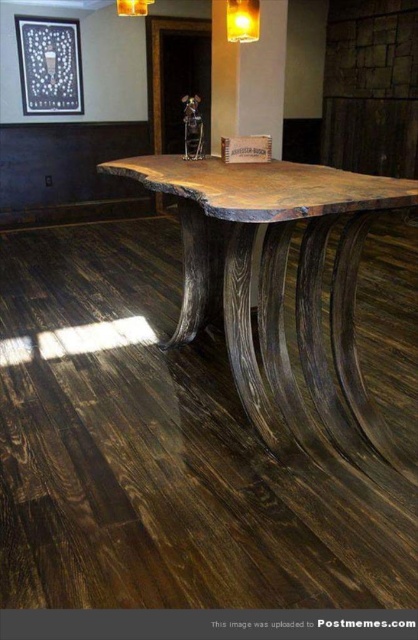
Between point (102, 168) and point (132, 1), which one is positioned behind?

The point (102, 168) is behind.

In order to click on dark wood table at center in this screenshot , I will do pos(282,292).

In the scene shown: Which is more to the right, matte yellow glass at upper center or matte gold lampshade at upper center?

Positioned to the right is matte yellow glass at upper center.

From the picture: Who is higher up, matte yellow glass at upper center or matte gold lampshade at upper center?

matte gold lampshade at upper center is higher up.

At what (x,y) coordinates should I click in order to perform the action: click on matte yellow glass at upper center. Please return your answer as a coordinate pair (x, y). Looking at the image, I should click on (242, 20).

In the scene shown: Is dark wood table at center positioned in front of matte yellow glass at upper center?

Yes, it is in front of matte yellow glass at upper center.

Is dark wood table at center taller than matte yellow glass at upper center?

Correct, dark wood table at center is much taller as matte yellow glass at upper center.

Which is in front, point (272, 164) or point (244, 17)?

Positioned in front is point (244, 17).

At what (x,y) coordinates should I click in order to perform the action: click on dark wood table at center. Please return your answer as a coordinate pair (x, y). Looking at the image, I should click on [x=282, y=292].